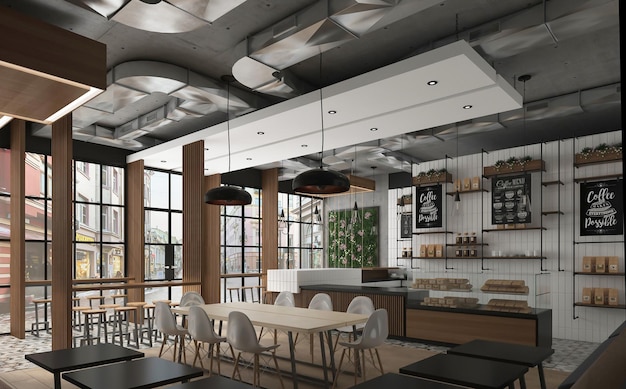
What are the coordinates of `counters` in the screenshot? It's located at (39, 283), (124, 285), (243, 274), (339, 287), (375, 269), (289, 271).